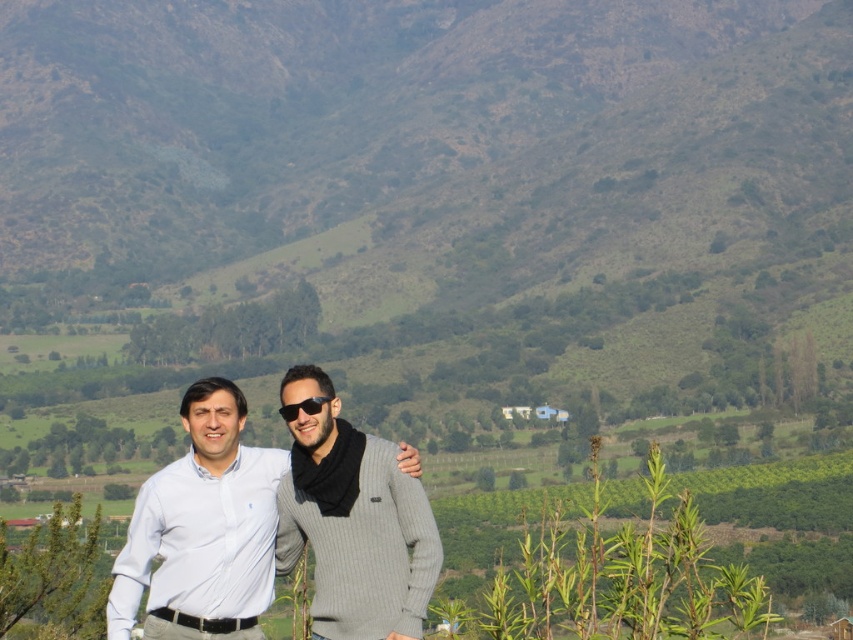
What do you see at coordinates (202, 531) in the screenshot? I see `white cotton shirt at center` at bounding box center [202, 531].

I want to click on white cotton shirt at center, so click(202, 531).